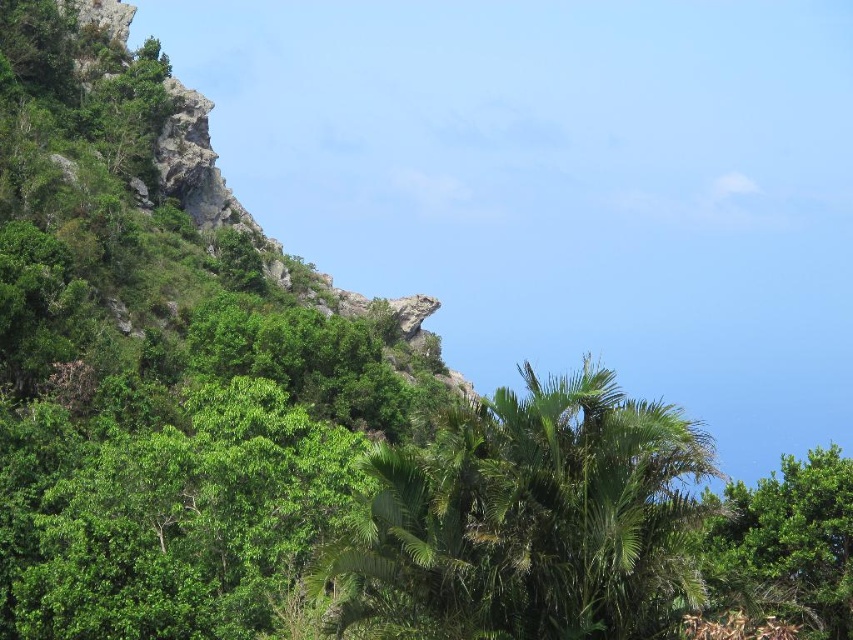
Which of these two, rugged stone mountain at upper left or green leafy palm at center, stands taller?

rugged stone mountain at upper left

The width and height of the screenshot is (853, 640). Identify the location of rugged stone mountain at upper left. (167, 244).

Image resolution: width=853 pixels, height=640 pixels. I want to click on rugged stone mountain at upper left, so click(167, 244).

Does green leafy palm at center have a lesser width compared to green leafy tree at lower right?

Incorrect, green leafy palm at center's width is not less than green leafy tree at lower right's.

In the scene shown: Can you confirm if green leafy palm at center is positioned above green leafy tree at lower right?

No.

Who is more distant from viewer, (469, 611) or (770, 484)?

Positioned behind is point (770, 484).

Image resolution: width=853 pixels, height=640 pixels. I want to click on green leafy palm at center, so click(x=531, y=520).

Measure the distance between point (303, 278) and camera.

Point (303, 278) and camera are 182.18 meters apart from each other.

I want to click on rugged stone mountain at upper left, so click(x=167, y=244).

The width and height of the screenshot is (853, 640). What are the coordinates of `rugged stone mountain at upper left` in the screenshot? It's located at (167, 244).